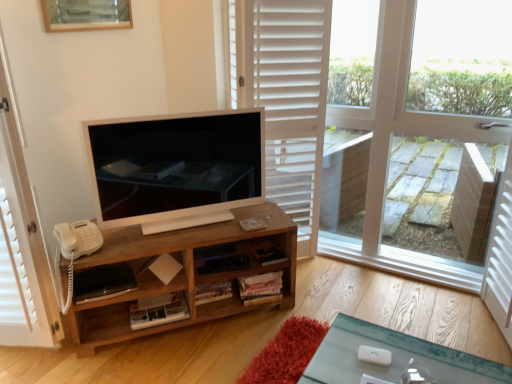
Question: In terms of size, does white wooden screen door at right, which ranks as the 1th screen door in right-to-left order, appear bigger or smaller than white wooden screen door at left, marked as the first screen door in a left-to-right arrangement?

Choices:
 (A) small
 (B) big

Answer: (A)

Question: Is white wooden screen door at right, which ranks as the 1th screen door in right-to-left order, inside the boundaries of white wooden screen door at left, marked as the first screen door in a left-to-right arrangement, or outside?

Choices:
 (A) outside
 (B) inside

Answer: (A)

Question: Estimate the real-world distances between objects in this image. Which object is closer to the white wooden screen door at right, which ranks as the 1th screen door in right-to-left order?

Choices:
 (A) satin white television at center
 (B) transparent glass window at center
 (C) wooden picture frame at upper center
 (D) wooden cabinet at center
 (E) white wooden screen door at left, which is counted as the second screen door, starting from the right

Answer: (B)

Question: Which object is the farthest from the white wooden screen door at left, which is counted as the second screen door, starting from the right?

Choices:
 (A) satin white television at center
 (B) white wooden screen door at right, which ranks as the 1th screen door in right-to-left order
 (C) wooden picture frame at upper center
 (D) transparent glass window at center
 (E) wooden cabinet at center

Answer: (B)